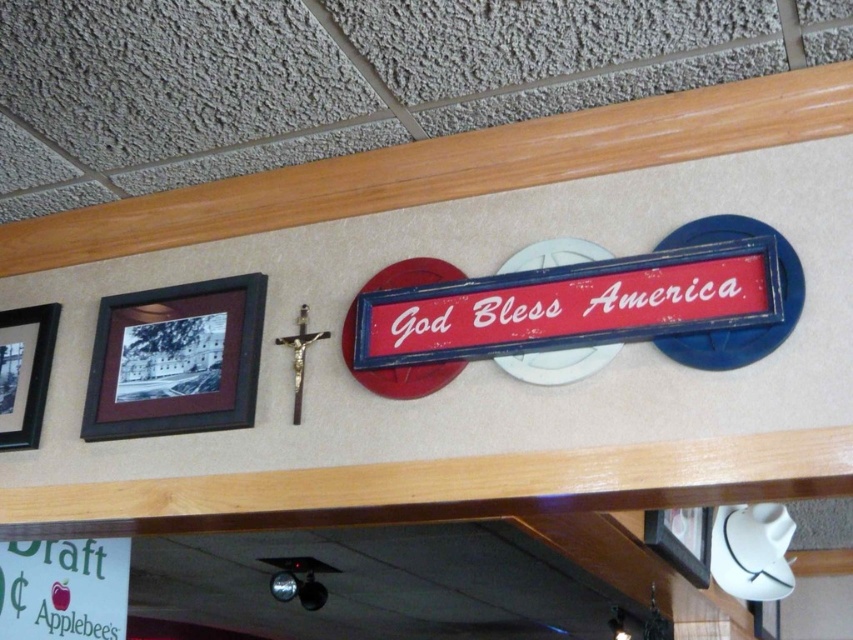
Is point (746, 289) farther from camera compared to point (39, 349)?

No, (746, 289) is closer to viewer.

Describe the element at coordinates (572, 305) in the screenshot. The image size is (853, 640). I see `red painted wood sign at center` at that location.

Is point (492, 294) more distant than point (26, 401)?

No, (492, 294) is closer to viewer.

Find the location of a particular element. This screenshot has width=853, height=640. red painted wood sign at center is located at coordinates (572, 305).

Who is lower down, matte black picture frame at left or black matte picture frame at left?

black matte picture frame at left is lower down.

Describe the element at coordinates (177, 358) in the screenshot. This screenshot has width=853, height=640. I see `matte black picture frame at left` at that location.

Does point (231, 285) lie in front of point (32, 416)?

Yes, it is.

This screenshot has width=853, height=640. I want to click on matte black picture frame at left, so click(x=177, y=358).

Who is positioned more to the right, black matte picture frame at left or matte black picture frame at lower right?

Positioned to the right is matte black picture frame at lower right.

Is black matte picture frame at left bigger than matte black picture frame at lower right?

Incorrect, black matte picture frame at left is not larger than matte black picture frame at lower right.

Who is more forward, [13,419] or [700,524]?

Point [13,419] is more forward.

At what (x,y) coordinates should I click in order to perform the action: click on black matte picture frame at left. Please return your answer as a coordinate pair (x, y). The height and width of the screenshot is (640, 853). Looking at the image, I should click on (24, 372).